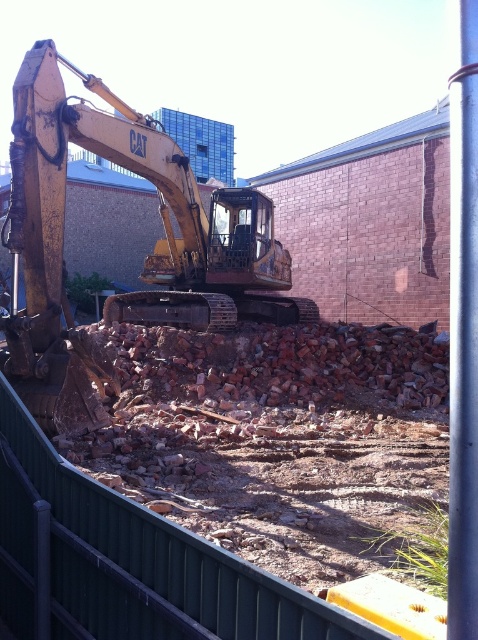
Can you confirm if yellow metallic excavator at left is positioned to the left of metallic silver pole at right?

Yes, yellow metallic excavator at left is to the left of metallic silver pole at right.

How far apart are yellow metallic excavator at left and metallic silver pole at right?

yellow metallic excavator at left and metallic silver pole at right are 5.32 meters apart.

Find the location of a particular element. yellow metallic excavator at left is located at coordinates (144, 259).

This screenshot has height=640, width=478. I want to click on yellow metallic excavator at left, so click(x=144, y=259).